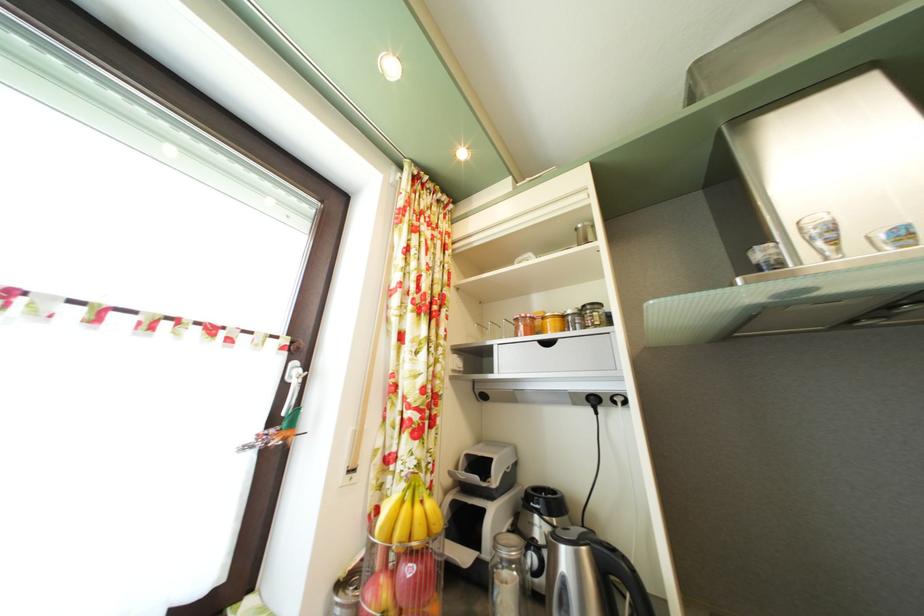
Where would you lift the grill handle? Please return your answer as a coordinate pair (x, y).

(789, 301)